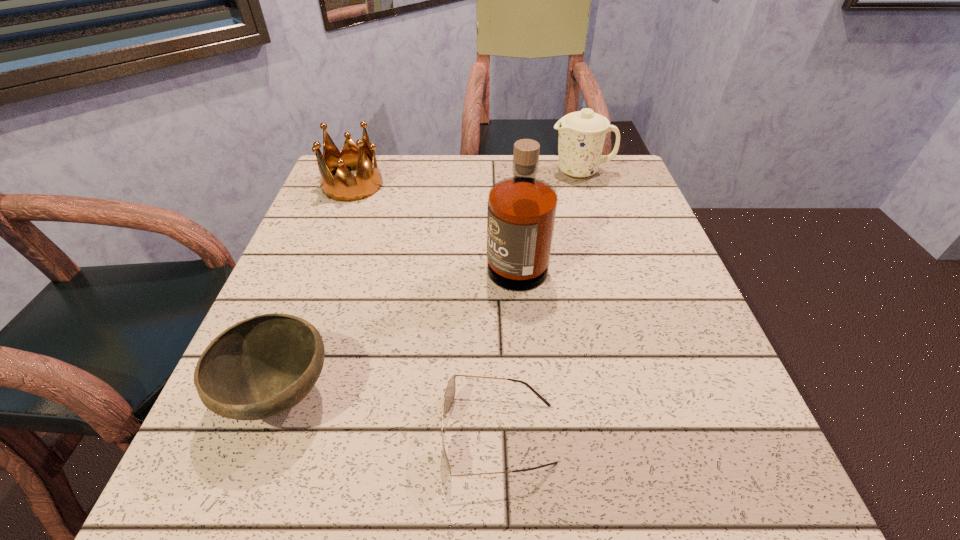
This screenshot has width=960, height=540. I want to click on vacant space located 0.150m on the spout of the chinaware, so click(493, 172).

Where is `vacant space located 0.060m on the spout of the chinaware`? vacant space located 0.060m on the spout of the chinaware is located at coordinates (526, 172).

The image size is (960, 540). What are the coordinates of `vacant area located 0.220m on the front of the crown` in the screenshot? It's located at click(x=324, y=261).

This screenshot has width=960, height=540. What are the coordinates of `vacant space located 0.080m on the back of the bowl` in the screenshot? It's located at (310, 316).

Find the location of a particular element. This screenshot has height=540, width=960. free region located 0.110m on the front-facing side of the shortest object is located at coordinates (369, 434).

The height and width of the screenshot is (540, 960). Find the location of `vacant area located 0.150m on the front-facing side of the shortest object`. vacant area located 0.150m on the front-facing side of the shortest object is located at coordinates (343, 434).

The width and height of the screenshot is (960, 540). I want to click on blank area located on the front-facing side of the shortest object, so point(289,434).

Where is `chinaware at the far edge`? The width and height of the screenshot is (960, 540). chinaware at the far edge is located at coordinates (581, 137).

Locate an element on the screen. The image size is (960, 540). crown present at the far edge is located at coordinates (344, 186).

Identify the location of object located in the near edge section of the desktop. (449, 395).